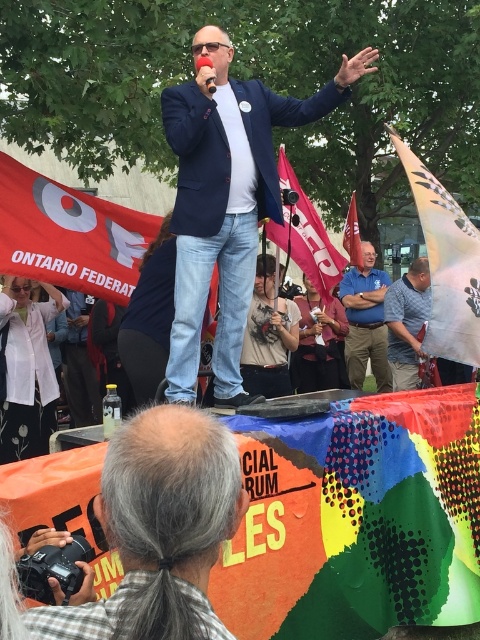
You are a photographer at the event. You want to capture a photo where the navy blue blazer at center is clearly visible above the red fabric flag at upper center. Is this possible based on their positions?

The navy blue blazer at center is much taller than the red fabric flag at upper center, so yes, it can be clearly visible above it in the photo.